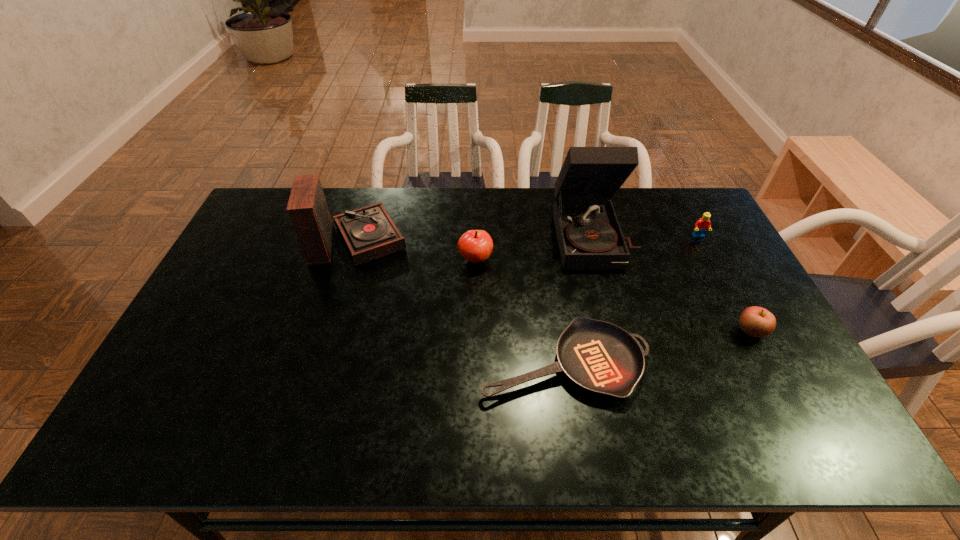
The image size is (960, 540). I want to click on vacant space at the right edge of the desktop, so (726, 274).

Identify the location of free location at the far right corner. (663, 191).

Locate an element on the screen. empty space between the right apple and the shortest object is located at coordinates (658, 347).

Find the location of a particular element. free area in between the left phonograph record and the right apple is located at coordinates (554, 285).

Identify the location of free point between the taller apple and the shorter apple. (613, 295).

This screenshot has height=540, width=960. I want to click on free space between the taller apple and the shorter apple, so click(x=613, y=295).

The width and height of the screenshot is (960, 540). Identify the location of vacant area that lies between the nearer apple and the left apple. (613, 295).

You are a GUI agent. You are given a task and a screenshot of the screen. Output one action in this format:
    pyautogui.click(x=<x>, y=<y>)
    Task: Click on the vacant point located between the taller phonograph record and the frying pan
    This screenshot has height=540, width=960.
    Given the screenshot: What is the action you would take?
    pyautogui.click(x=579, y=299)

Where is `empty space between the Lego and the shorter phonograph record`? This screenshot has height=540, width=960. empty space between the Lego and the shorter phonograph record is located at coordinates (527, 238).

Locate an element on the screen. free space between the farther apple and the shortest object is located at coordinates (520, 311).